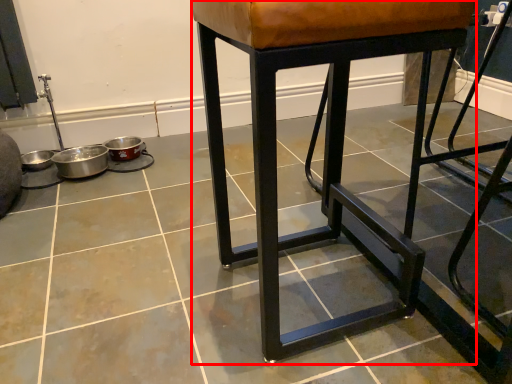
Question: From the image's perspective, considering the relative positions of stool (annotated by the red box) and concrete in the image provided, where is stool (annotated by the red box) located with respect to the staircase?

Choices:
 (A) below
 (B) above

Answer: (B)